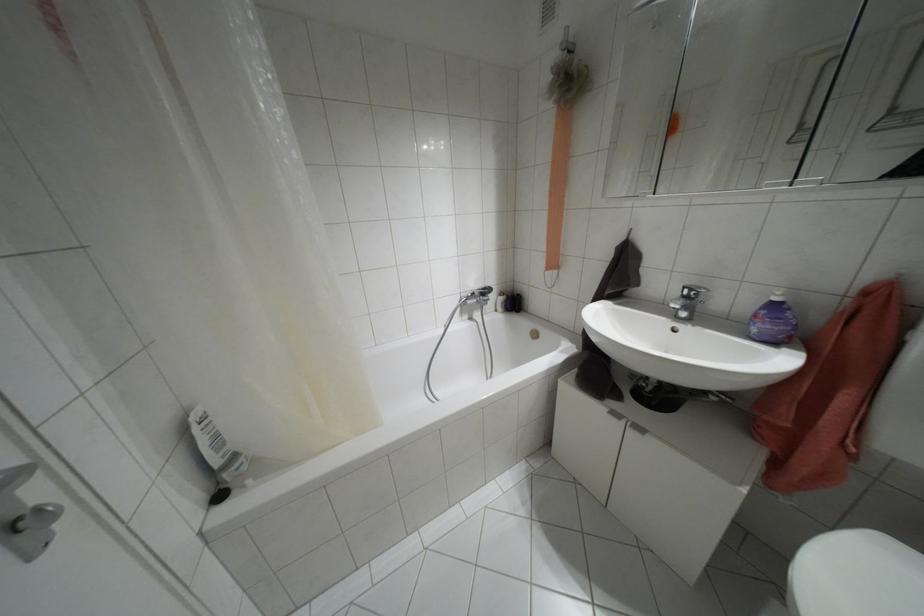
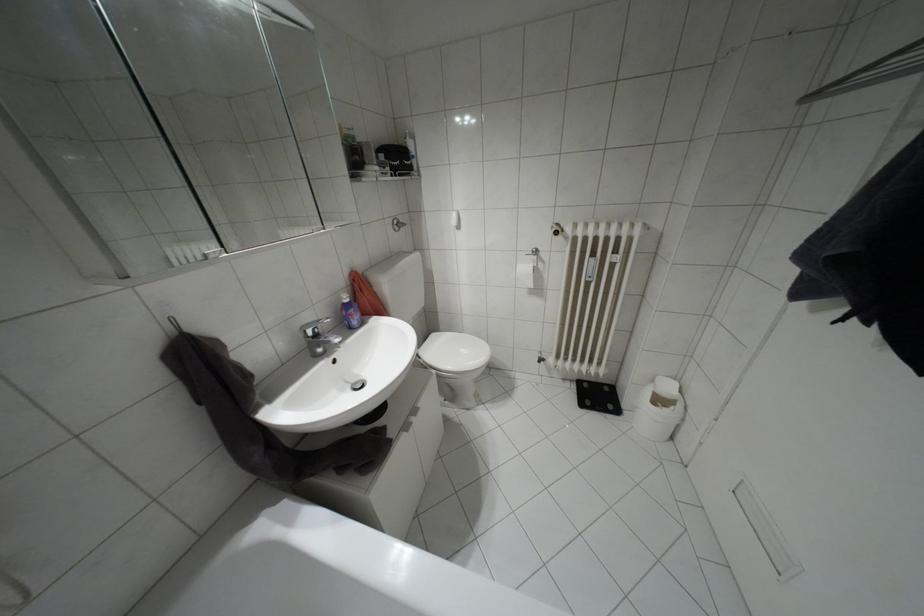
Where in the second image is the point corresponding to (774,299) from the first image?

(346, 300)